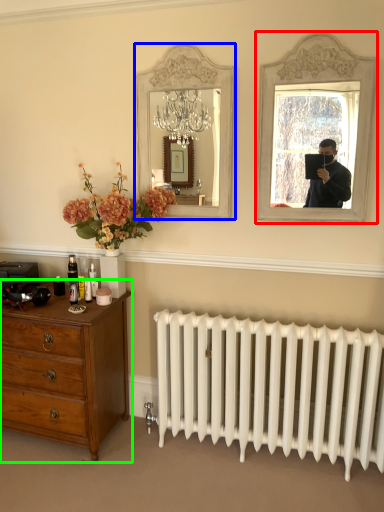
Question: Which is farther away from picture frame (highlighted by a red box)? mirror (highlighted by a blue box) or chest of drawers (highlighted by a green box)?

Choices:
 (A) mirror
 (B) chest of drawers

Answer: (B)